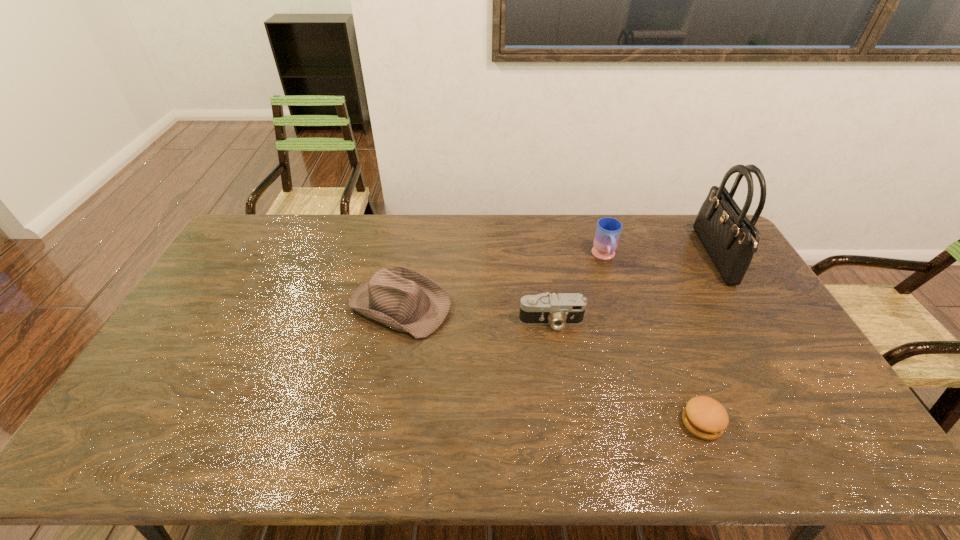
The image size is (960, 540). In order to click on empty location between the handbag and the shortest object in this screenshot , I will do `click(708, 340)`.

This screenshot has height=540, width=960. Find the location of `vacant region between the camera and the fourth object from left to right`. vacant region between the camera and the fourth object from left to right is located at coordinates (627, 372).

Identify the location of free space between the leftmost object and the second object from left to right. click(476, 313).

Find the location of `free space between the second object from left to right and the fedora`. free space between the second object from left to right and the fedora is located at coordinates (476, 313).

Where is `vacant area that lies between the second shortest object and the second object from right to left`? The image size is (960, 540). vacant area that lies between the second shortest object and the second object from right to left is located at coordinates (627, 372).

Image resolution: width=960 pixels, height=540 pixels. I want to click on the third closest object to the rightmost object, so click(557, 310).

Select which object appears as the closest to the mug. Please provide its 2D coordinates. Your answer should be formatted as a tuple, i.e. [(x, y)], where the tuple contains the x and y coordinates of a point satisfying the conditions above.

[(557, 310)]

Find the location of a particular element. vacant space that satisfies the following two spatial constraints: 1. on the side of the third object from right to left with the handle; 2. on the left side of the shortest object is located at coordinates (657, 422).